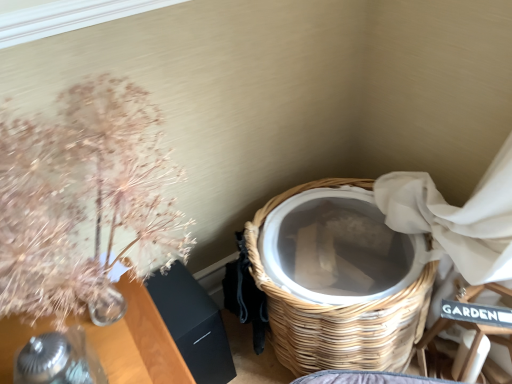
Question: Considering the relative sizes of wooden armchair at lower right and translucent glass vase with dried flowers at upper left in the image provided, is wooden armchair at lower right smaller than translucent glass vase with dried flowers at upper left?

Choices:
 (A) yes
 (B) no

Answer: (A)

Question: Can you confirm if wooden armchair at lower right is shorter than translucent glass vase with dried flowers at upper left?

Choices:
 (A) no
 (B) yes

Answer: (A)

Question: Is translucent glass vase with dried flowers at upper left located within wooden armchair at lower right?

Choices:
 (A) no
 (B) yes

Answer: (A)

Question: Is wooden armchair at lower right turned away from translucent glass vase with dried flowers at upper left?

Choices:
 (A) yes
 (B) no

Answer: (B)

Question: Are wooden armchair at lower right and translucent glass vase with dried flowers at upper left beside each other?

Choices:
 (A) yes
 (B) no

Answer: (B)

Question: From a real-world perspective, is wooden armchair at lower right on top of translucent glass vase with dried flowers at upper left?

Choices:
 (A) no
 (B) yes

Answer: (A)

Question: Could you tell me if translucent glass vase with dried flowers at upper left is turned towards woven wood basket at lower right?

Choices:
 (A) no
 (B) yes

Answer: (A)

Question: Is translucent glass vase with dried flowers at upper left outside of woven wood basket at lower right?

Choices:
 (A) yes
 (B) no

Answer: (A)

Question: Are translucent glass vase with dried flowers at upper left and woven wood basket at lower right far apart?

Choices:
 (A) no
 (B) yes

Answer: (A)

Question: Is the depth of translucent glass vase with dried flowers at upper left greater than that of woven wood basket at lower right?

Choices:
 (A) no
 (B) yes

Answer: (A)

Question: Is translucent glass vase with dried flowers at upper left taller than woven wood basket at lower right?

Choices:
 (A) yes
 (B) no

Answer: (B)

Question: From a real-world perspective, does translucent glass vase with dried flowers at upper left stand above woven wood basket at lower right?

Choices:
 (A) no
 (B) yes

Answer: (B)

Question: Is wooden armchair at lower right smaller than woven wood basket at lower right?

Choices:
 (A) yes
 (B) no

Answer: (A)